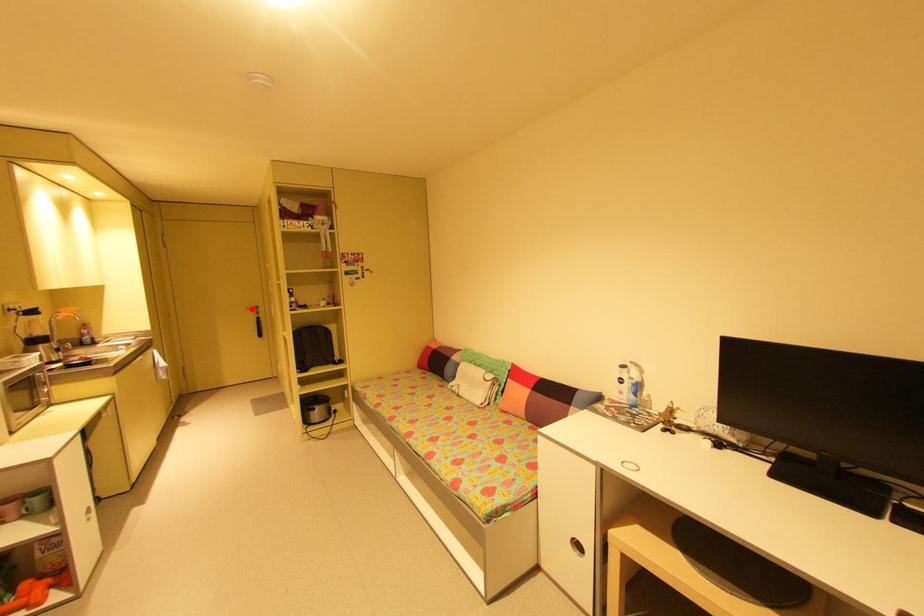
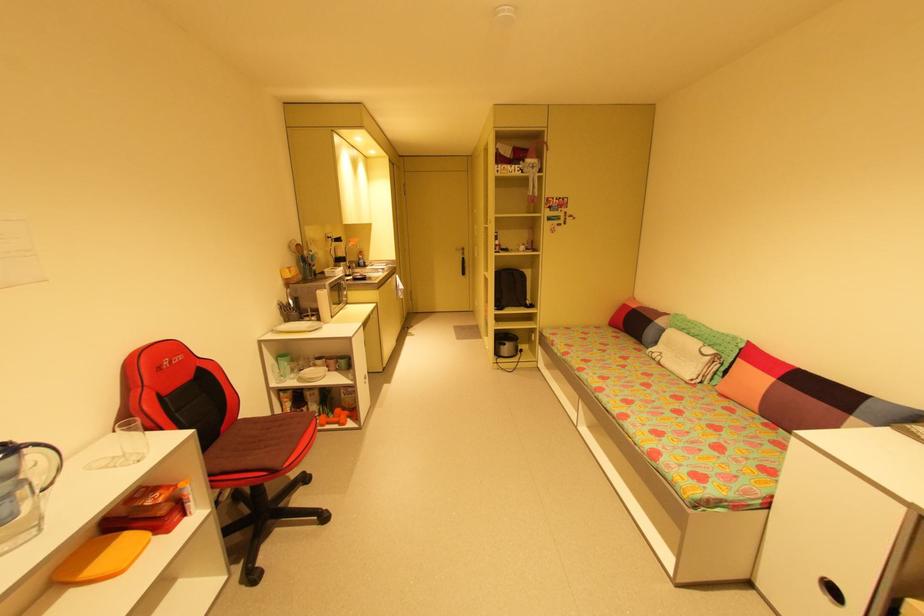
Where in the second image is the point corresponding to the highlighted location from the first image?

(460, 249)